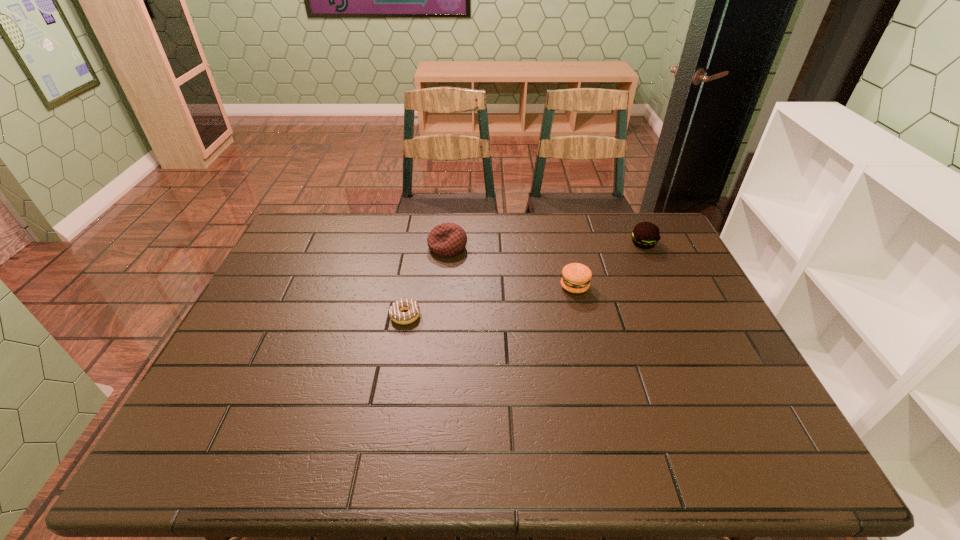
Locate an element on the screen. free space located on the front of the shortest object is located at coordinates (392, 392).

Locate an element on the screen. This screenshot has width=960, height=540. beanbag positioned at the far edge is located at coordinates (445, 240).

Where is `patty situated at the far edge`? This screenshot has height=540, width=960. patty situated at the far edge is located at coordinates (645, 235).

Where is `object positioned at the right edge`? Image resolution: width=960 pixels, height=540 pixels. object positioned at the right edge is located at coordinates (645, 235).

The height and width of the screenshot is (540, 960). What are the coordinates of `object located in the far right corner section of the desktop` in the screenshot? It's located at (645, 235).

Identify the location of vacant space at the far edge of the desktop. The height and width of the screenshot is (540, 960). (498, 219).

This screenshot has height=540, width=960. Find the location of `vacant region at the near edge`. vacant region at the near edge is located at coordinates (594, 433).

Find the location of `free space at the left edge of the desktop`. free space at the left edge of the desktop is located at coordinates coord(293,314).

Locate an element on the screen. free spot at the right edge of the desktop is located at coordinates (699, 320).

Where is `blank area at the near left corner`? This screenshot has width=960, height=540. blank area at the near left corner is located at coordinates (x=183, y=436).